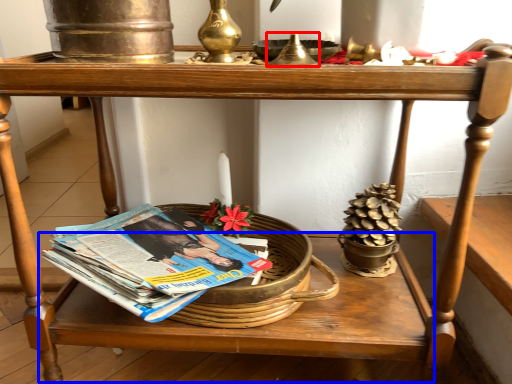
Question: Which point is closer to the camera, candle holder (highlighted by a red box) or table (highlighted by a blue box)?

Choices:
 (A) candle holder
 (B) table

Answer: (A)